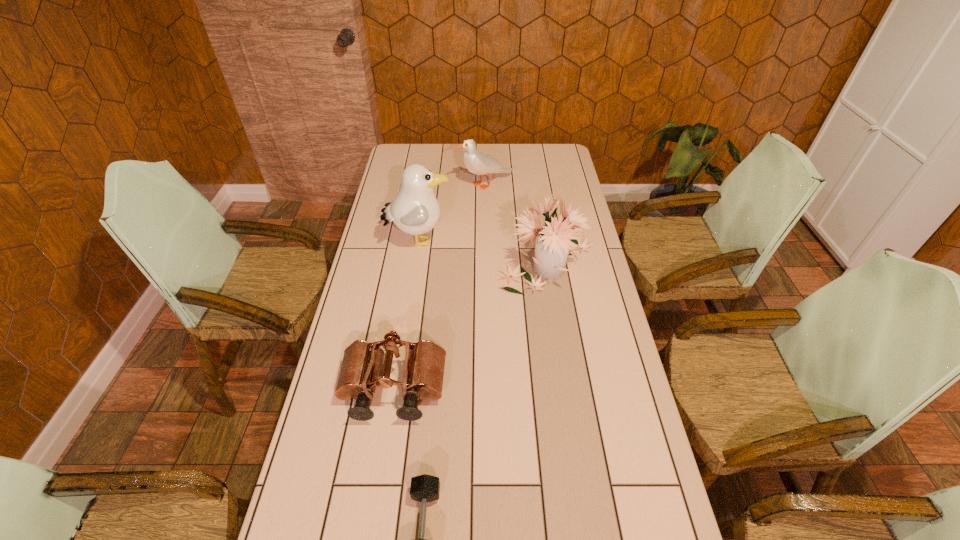
Locate an element on the screen. vacant space located at the beak of the third shortest object is located at coordinates (396, 185).

The image size is (960, 540). I want to click on free space located 0.170m at the beak of the third shortest object, so click(420, 185).

Find the location of a particular element. The width and height of the screenshot is (960, 540). vacant space located through the eyepieces of the fourth tallest object is located at coordinates (372, 523).

This screenshot has height=540, width=960. I want to click on gull that is at the left edge, so click(415, 210).

Where is `binoculars present at the left edge`? Image resolution: width=960 pixels, height=540 pixels. binoculars present at the left edge is located at coordinates (424, 364).

Find the location of `object located in the right edge section of the desktop`. object located in the right edge section of the desktop is located at coordinates (553, 239).

Where is `vacant region at the far edge of the desktop`? This screenshot has height=540, width=960. vacant region at the far edge of the desktop is located at coordinates (440, 156).

In the image, there is a desktop. Where is `vacant region at the left edge`? The width and height of the screenshot is (960, 540). vacant region at the left edge is located at coordinates (373, 223).

The height and width of the screenshot is (540, 960). In the image, there is a desktop. Identify the location of free space at the right edge. (595, 329).

In the image, there is a desktop. At what (x,y) coordinates should I click in order to perform the action: click on vacant region at the far right corner. Please return your answer as a coordinate pair (x, y). The image size is (960, 540). Looking at the image, I should click on (558, 157).